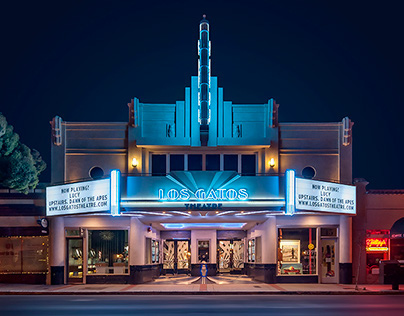
Where is `poster`? poster is located at coordinates (288, 247).